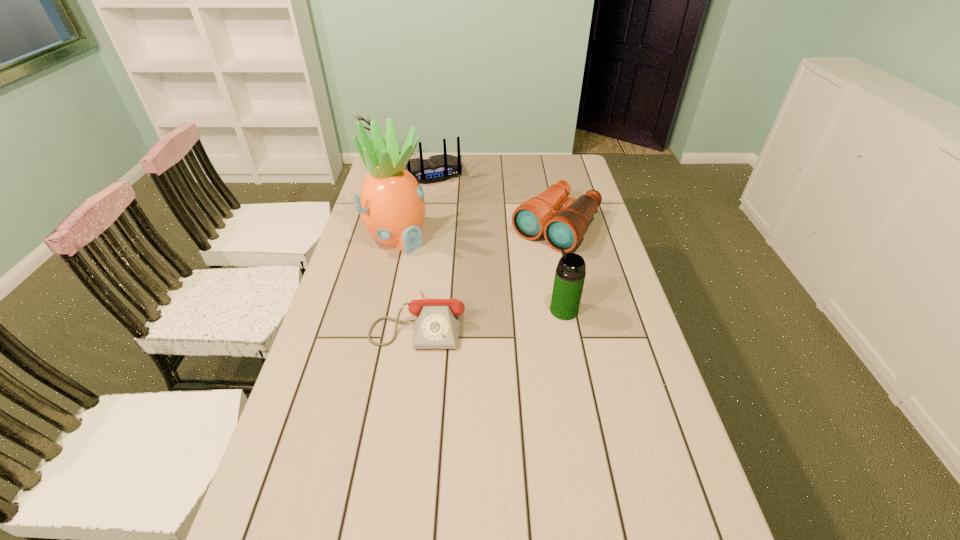
In the image, there is a desktop. Where is `vacant space at the far right corner`? Image resolution: width=960 pixels, height=540 pixels. vacant space at the far right corner is located at coordinates (558, 181).

The height and width of the screenshot is (540, 960). What are the coordinates of `vacant space at the near right corner` in the screenshot? It's located at (645, 523).

Where is `free space between the farthest object and the fourth shortest object`? free space between the farthest object and the fourth shortest object is located at coordinates (496, 242).

At what (x,y) coordinates should I click in order to perform the action: click on unoccupied position between the binoculars and the shortest object. Please return your answer as a coordinate pair (x, y). This screenshot has height=540, width=960. Looking at the image, I should click on (488, 274).

At what (x,y) coordinates should I click in order to perform the action: click on blank region between the telephone and the third tallest object. Please return your answer as a coordinate pair (x, y). Looking at the image, I should click on (423, 247).

The width and height of the screenshot is (960, 540). In order to click on empty space that is in between the shortest object and the tallest object in this screenshot , I will do `click(408, 278)`.

This screenshot has width=960, height=540. I want to click on vacant region between the shortest object and the pineapple, so click(x=408, y=278).

Locate an element on the screen. This screenshot has height=540, width=960. empty location between the third tallest object and the binoculars is located at coordinates (492, 201).

Find the location of a particular element. vacant area between the pineapple and the telephone is located at coordinates (408, 278).

You are a GUI agent. You are given a task and a screenshot of the screen. Output one action in this format:
    pyautogui.click(x=<x>, y=<y>)
    Task: Click on the free space between the second tallest object and the telephone
    
    Given the screenshot: What is the action you would take?
    pyautogui.click(x=492, y=315)